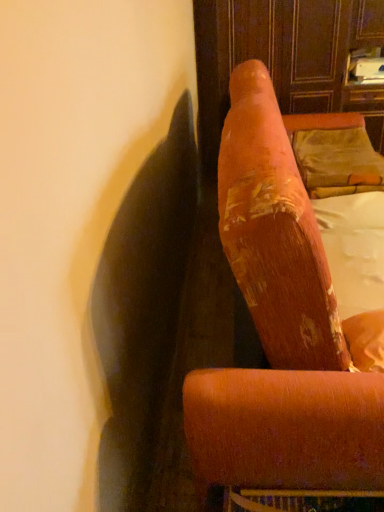
Question: Can you confirm if velvet gold pillow at upper right is wider than white fabric at upper right?

Choices:
 (A) yes
 (B) no

Answer: (A)

Question: Is velvet gold pillow at upper right far away from white fabric at upper right?

Choices:
 (A) no
 (B) yes

Answer: (A)

Question: Does velvet gold pillow at upper right have a smaller size compared to white fabric at upper right?

Choices:
 (A) no
 (B) yes

Answer: (B)

Question: Does velvet gold pillow at upper right have a greater height compared to white fabric at upper right?

Choices:
 (A) no
 (B) yes

Answer: (B)

Question: Considering the relative sizes of velvet gold pillow at upper right and white fabric at upper right in the image provided, is velvet gold pillow at upper right shorter than white fabric at upper right?

Choices:
 (A) yes
 (B) no

Answer: (B)

Question: Is velvet gold pillow at upper right turned away from white fabric at upper right?

Choices:
 (A) yes
 (B) no

Answer: (B)

Question: From the image's perspective, does white fabric at upper right appear higher than velvet gold pillow at upper right?

Choices:
 (A) yes
 (B) no

Answer: (B)

Question: Considering the relative sizes of white fabric at upper right and velvet gold pillow at upper right in the image provided, is white fabric at upper right shorter than velvet gold pillow at upper right?

Choices:
 (A) yes
 (B) no

Answer: (A)

Question: Is white fabric at upper right taller than velvet gold pillow at upper right?

Choices:
 (A) yes
 (B) no

Answer: (B)

Question: Does white fabric at upper right come behind velvet gold pillow at upper right?

Choices:
 (A) yes
 (B) no

Answer: (B)

Question: From the image's perspective, is white fabric at upper right below velvet gold pillow at upper right?

Choices:
 (A) no
 (B) yes

Answer: (B)

Question: Is white fabric at upper right not within velvet gold pillow at upper right?

Choices:
 (A) no
 (B) yes

Answer: (B)

Question: Is velvet orange armchair at upper right positioned far away from white fabric at upper right?

Choices:
 (A) no
 (B) yes

Answer: (A)